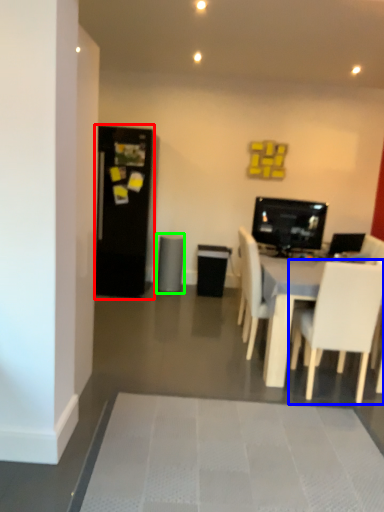
Question: Which is nearer to the fridge (highlighted by a red box)? chair (highlighted by a blue box) or speaker (highlighted by a green box).

Choices:
 (A) chair
 (B) speaker

Answer: (B)